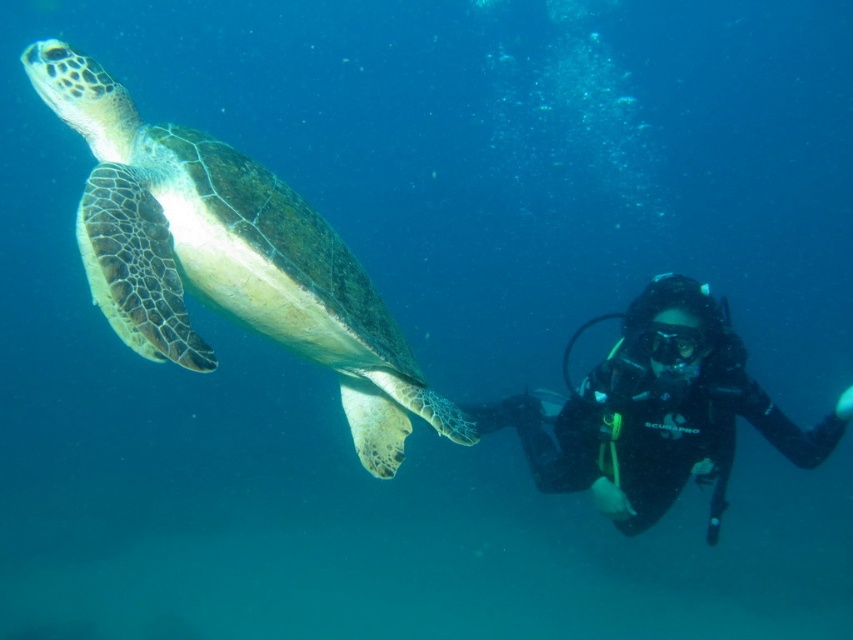
Who is more forward, (415, 378) or (631, 376)?

Point (415, 378) is more forward.

Does point (300, 328) come closer to viewer compared to point (610, 484)?

Yes.

Does point (32, 74) come closer to viewer compared to point (634, 458)?

Yes, point (32, 74) is closer to viewer.

You are a GUI agent. You are given a task and a screenshot of the screen. Output one action in this format:
    pyautogui.click(x=<x>, y=<y>)
    Task: Click on the green textured shell at left
    This screenshot has height=640, width=853.
    Given the screenshot: What is the action you would take?
    pyautogui.click(x=227, y=257)